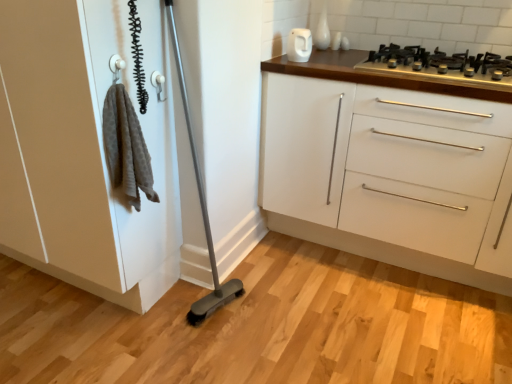
Question: In terms of width, does white glossy cabinet at upper right look wider or thinner when compared to white matte cabinet at left?

Choices:
 (A) thin
 (B) wide

Answer: (B)

Question: Based on their positions, is white glossy cabinet at upper right located to the left or right of white matte cabinet at left?

Choices:
 (A) left
 (B) right

Answer: (B)

Question: Estimate the real-world distances between objects in this image. Which object is closer to the white matte cabinet at left?

Choices:
 (A) white plastic door handle at upper center
 (B) white glossy cabinet at upper right
 (C) black metal gas stove at upper right
 (D) white glossy electric kettle at upper center

Answer: (A)

Question: Estimate the real-world distances between objects in this image. Which object is closer to the white glossy electric kettle at upper center?

Choices:
 (A) black metal gas stove at upper right
 (B) white matte cabinet at left
 (C) white plastic door handle at upper center
 (D) white glossy cabinet at upper right

Answer: (A)